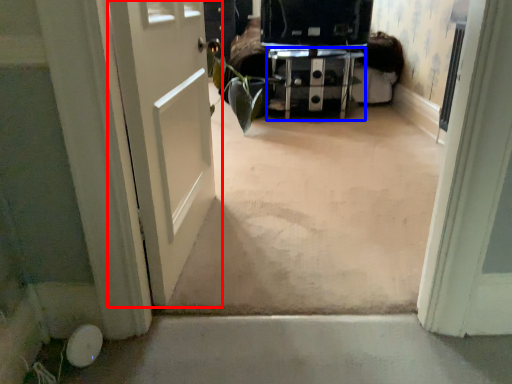
Question: Which point is further to the camera, door (highlighted by a red box) or furniture (highlighted by a blue box)?

Choices:
 (A) door
 (B) furniture

Answer: (B)